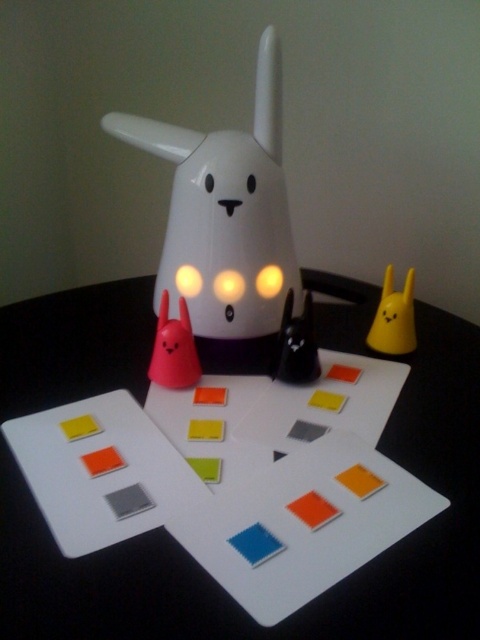
Question: Is matte pink cone at center to the left of yellow matte rabbit at upper right from the viewer's perspective?

Choices:
 (A) yes
 (B) no

Answer: (A)

Question: Can you confirm if white plastic table at center is bigger than matte pink cone at center?

Choices:
 (A) yes
 (B) no

Answer: (A)

Question: Which of the following is the closest to the observer?

Choices:
 (A) (379, 333)
 (B) (180, 300)
 (C) (268, 154)

Answer: (B)

Question: Which point is closer to the camera taking this photo?

Choices:
 (A) (399, 305)
 (B) (363, 570)

Answer: (B)

Question: Does white glossy rabbit at center appear on the right side of matte pink cone at center?

Choices:
 (A) no
 (B) yes

Answer: (B)

Question: Estimate the real-world distances between objects in this image. Which object is farther from the matte pink cone at center?

Choices:
 (A) yellow matte rabbit at upper right
 (B) white glossy rabbit at center

Answer: (A)